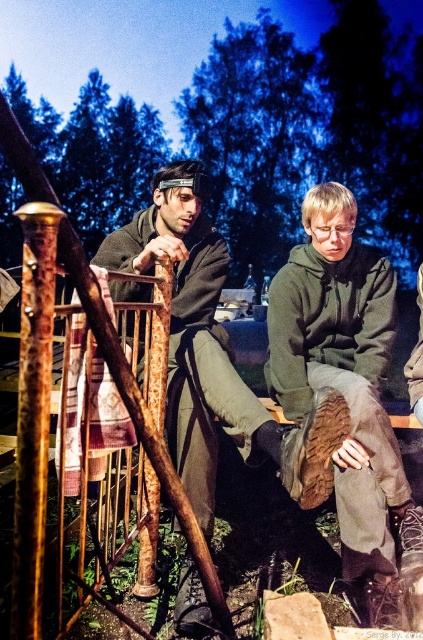
You are an observer standing in front of the rustic wooden structure. You see the green fuzzy hoodie at center and the matte brown wooden stick at left. Which object is closer to you?

The green fuzzy hoodie at center is closer to you because the matte brown wooden stick at left is behind it.

You are a photographer trying to capture a photo of the green fuzzy hoodie at center and the matte brown wooden stick at left. Which object should you focus on first if you want to ensure both are in focus without adjusting the camera settings?

The green fuzzy hoodie at center has a lesser height compared to matte brown wooden stick at left, so you should focus on the matte brown wooden stick at left first because it is farther away from the camera, ensuring both objects will be in focus with a single focal point.